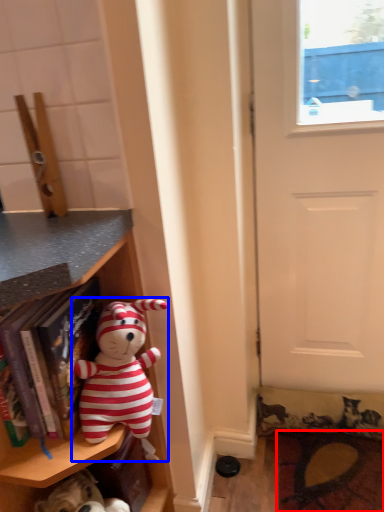
Question: Which object is closer to the camera taking this photo, doormat (highlighted by a red box) or toy (highlighted by a blue box)?

Choices:
 (A) doormat
 (B) toy

Answer: (B)